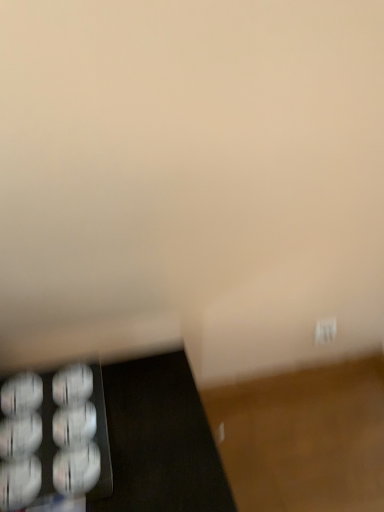
This screenshot has width=384, height=512. I want to click on vacant region above black glossy tray at lower left (from a real-world perspective), so (x=120, y=435).